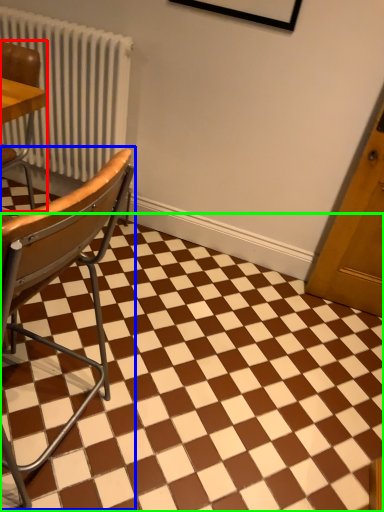
Question: Which is nearer to the chair (highlighted by a red box)? chair (highlighted by a blue box) or square (highlighted by a green box).

Choices:
 (A) chair
 (B) square

Answer: (A)